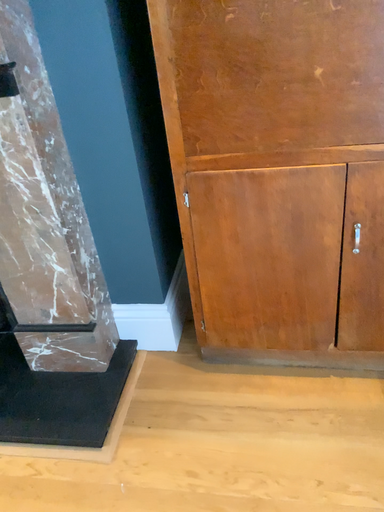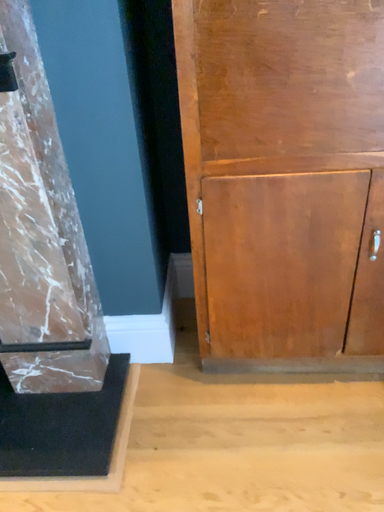
Question: How did the camera likely rotate when shooting the video?

Choices:
 (A) rotated left
 (B) rotated right

Answer: (B)